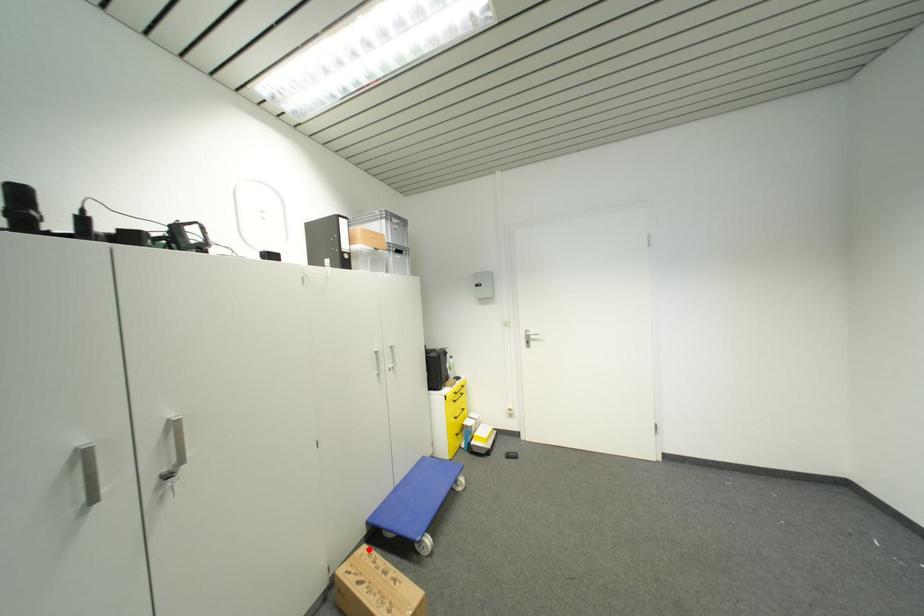
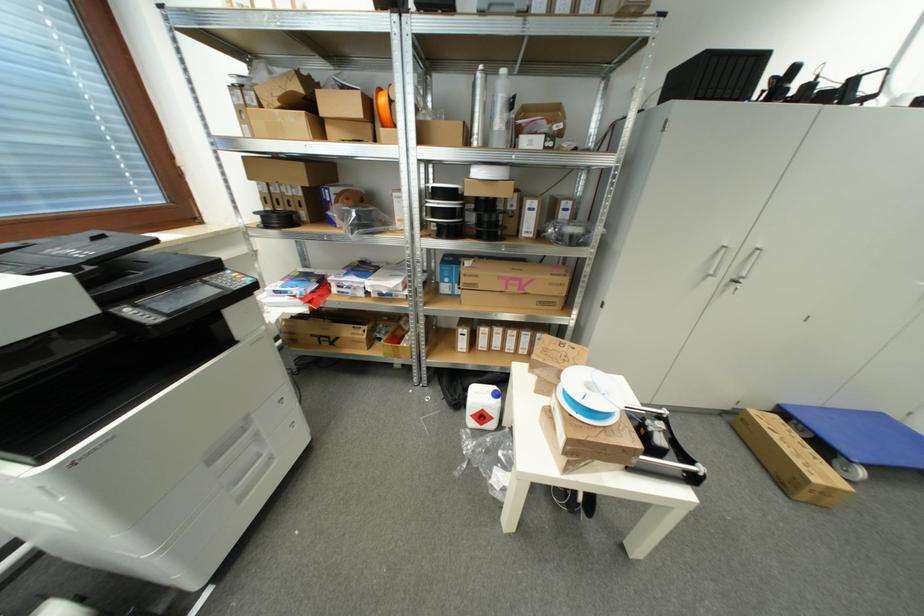
In the second image, find the point that corresponds to the highlighted location in the first image.

(781, 419)